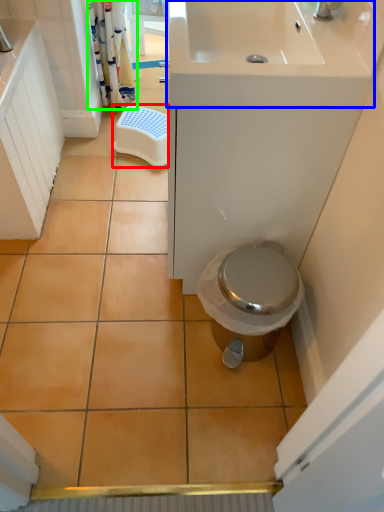
Question: Considering the real-world distances, which object is closest to step stool (highlighted by a red box)? sink (highlighted by a blue box) or shower curtain (highlighted by a green box).

Choices:
 (A) sink
 (B) shower curtain

Answer: (B)